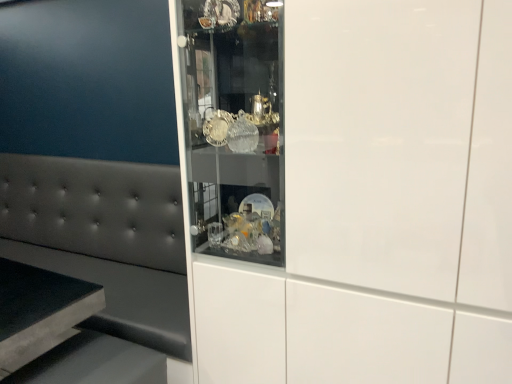
Question: Which is correct: matte gray cushion at left is inside white glossy cabinet at center, or outside of it?

Choices:
 (A) inside
 (B) outside

Answer: (B)

Question: Is matte gray cushion at left wider or thinner than white glossy cabinet at center?

Choices:
 (A) thin
 (B) wide

Answer: (A)

Question: From a real-world perspective, is matte gray cushion at left positioned above or below white glossy cabinet at center?

Choices:
 (A) below
 (B) above

Answer: (A)

Question: Is white glossy cabinet at center bigger or smaller than matte gray cushion at left?

Choices:
 (A) big
 (B) small

Answer: (B)

Question: From the image's perspective, is white glossy cabinet at center positioned above or below matte gray cushion at left?

Choices:
 (A) above
 (B) below

Answer: (A)

Question: From a real-world perspective, is white glossy cabinet at center physically located above or below matte gray cushion at left?

Choices:
 (A) above
 (B) below

Answer: (A)

Question: Considering the positions of point (321, 256) and point (142, 168), is point (321, 256) closer or farther from the camera than point (142, 168)?

Choices:
 (A) closer
 (B) farther

Answer: (A)